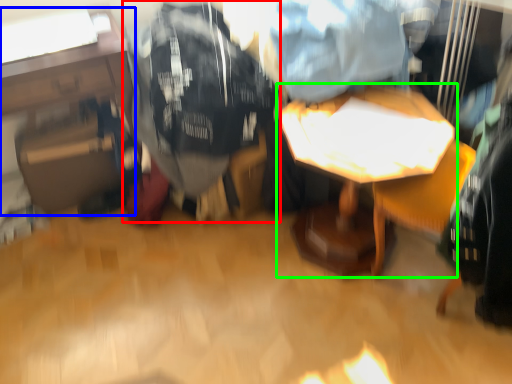
Question: Estimate the real-world distances between objects in this image. Which object is closer to clothing (highlighted by a red box), table (highlighted by a blue box) or table (highlighted by a green box)?

Choices:
 (A) table
 (B) table

Answer: (A)